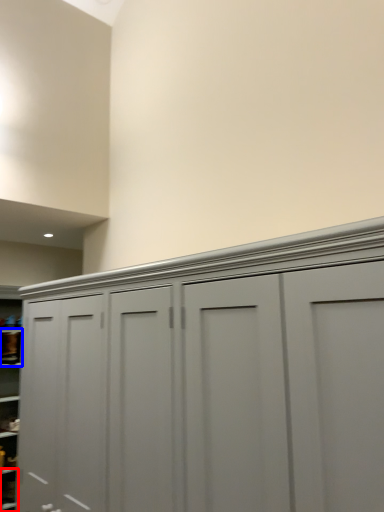
Question: Among these objects, which one is farthest to the camera, cabinet (highlighted by a red box) or cabinet (highlighted by a blue box)?

Choices:
 (A) cabinet
 (B) cabinet

Answer: (B)